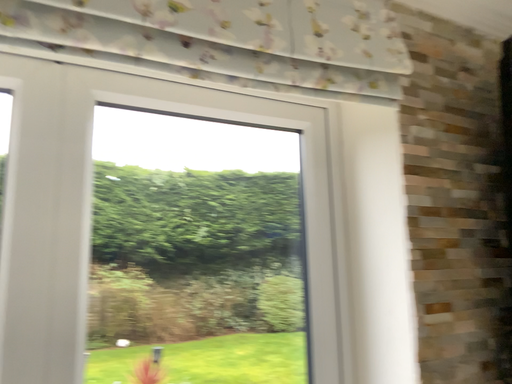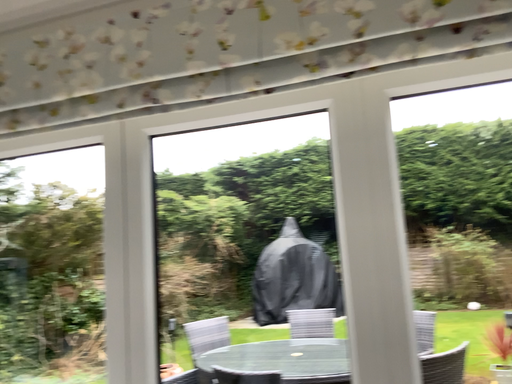
Question: How did the camera likely rotate when shooting the video?

Choices:
 (A) rotated right
 (B) rotated left

Answer: (B)